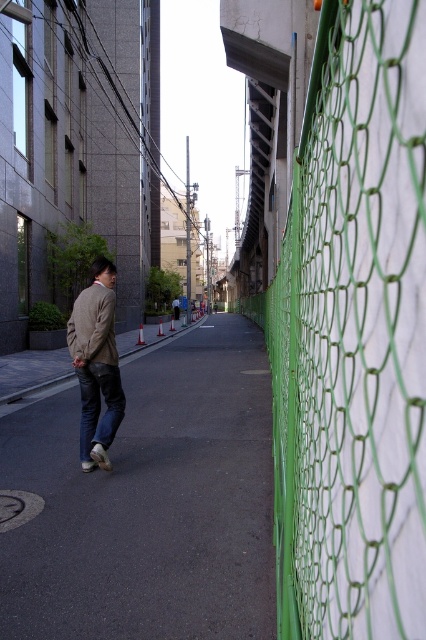
You are standing at the intersection and want to take a photo of the green mesh fence at right. Based on its position in the scene, where should you aim your camera to capture it in the frame?

The green mesh fence at right is located at point (353,336), so you should aim your camera towards the lower right quadrant of the frame to capture it in the photo.

You are a pedestrian standing on the sidewalk. You see the green mesh fence at right and the black asphalt pavement at center. Which object is nearer to you?

The green mesh fence at right is closer to the viewer than the black asphalt pavement at center.